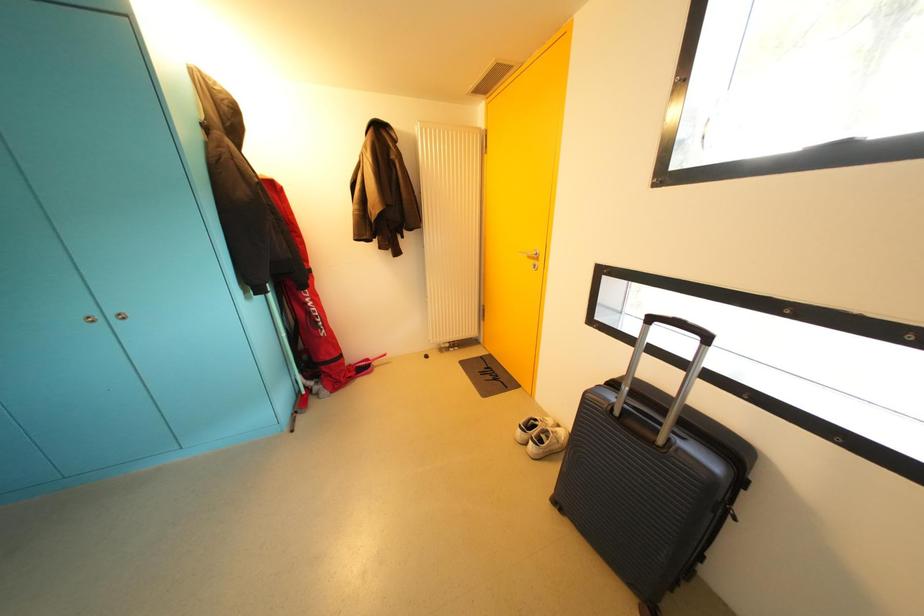
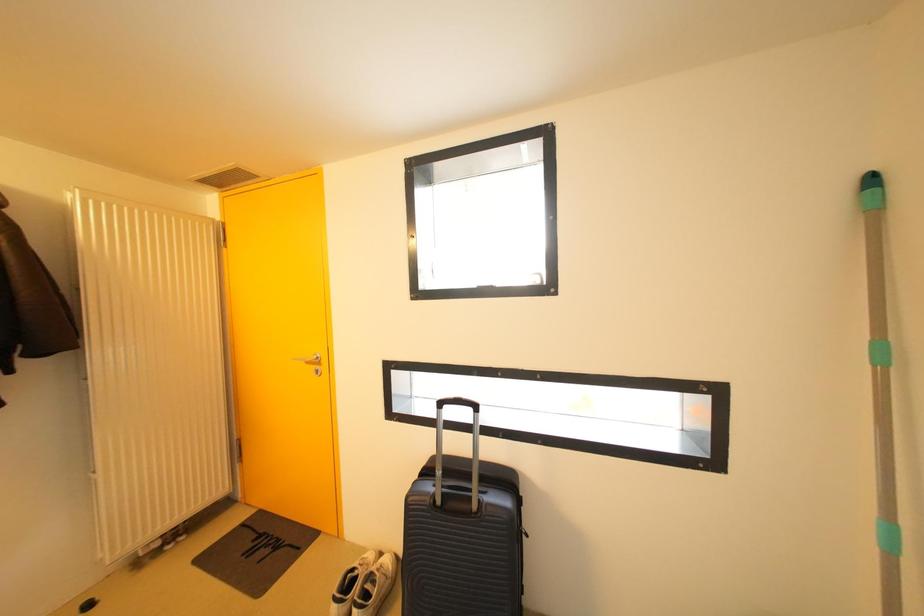
Question: The camera is either moving clockwise (left) or counter-clockwise (right) around the object. The first image is from the beginning of the video and the second image is from the end. Is the camera moving left or right when shooting the video?

Choices:
 (A) Left
 (B) Right

Answer: (A)